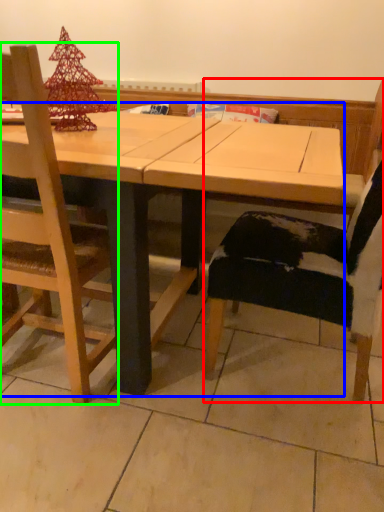
Question: Which object is positioned closest to chair (highlighted by a red box)? Select from table (highlighted by a blue box) and chair (highlighted by a green box).

Choices:
 (A) table
 (B) chair

Answer: (A)